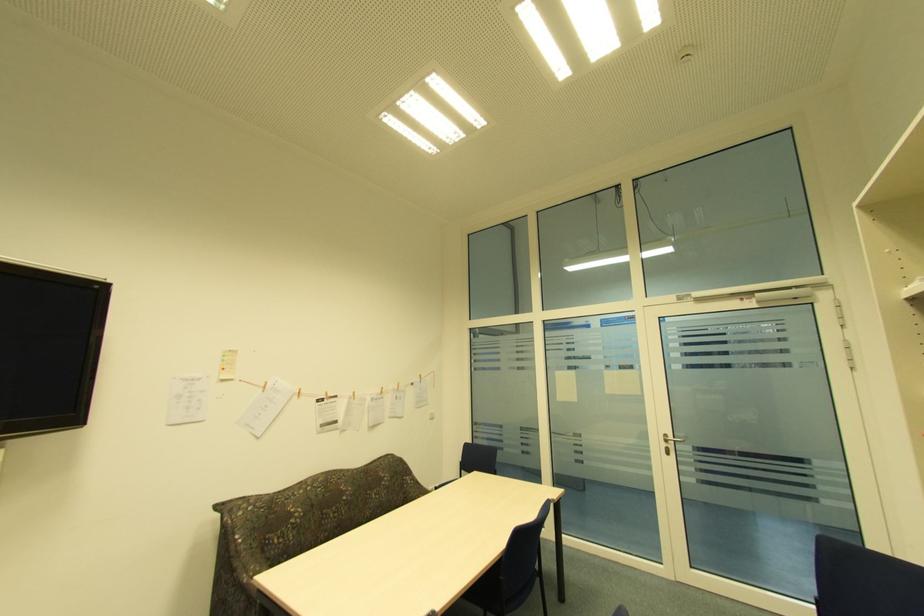
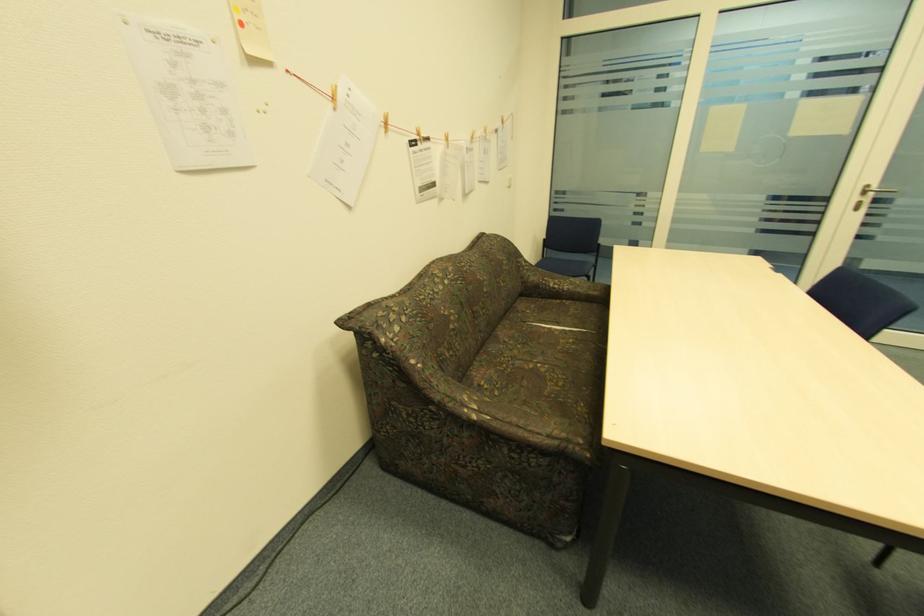
Find the pixel in the second image that matches (669,435) in the first image.

(870, 187)